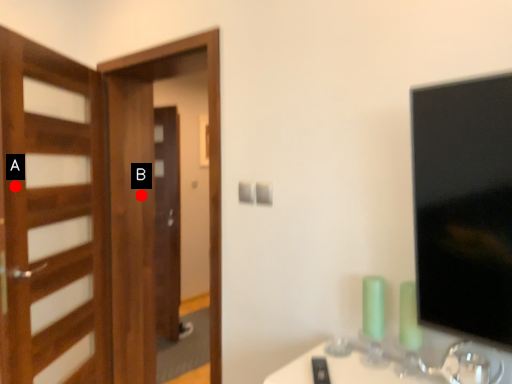
Question: Two points are circled on the image, labeled by A and B beside each circle. Which point is closer to the camera taking this photo?

Choices:
 (A) A is closer
 (B) B is closer

Answer: (A)